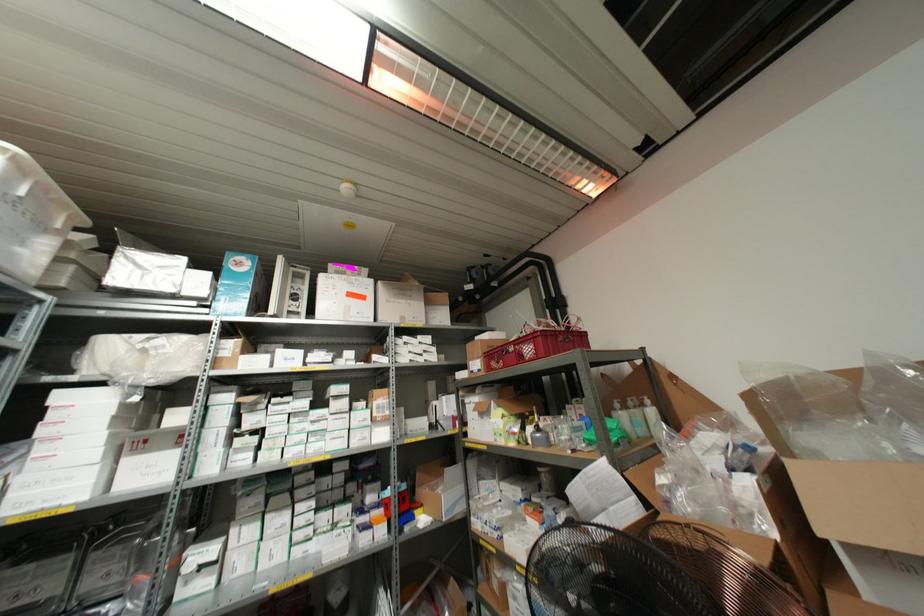
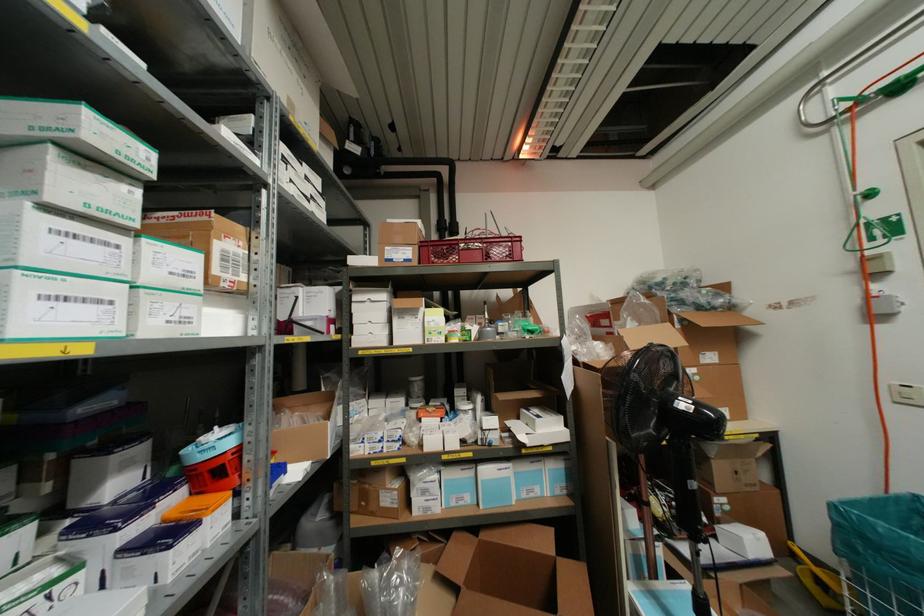
The point at (368, 421) is marked in the first image. Where is the corresponding point in the second image?

(196, 283)